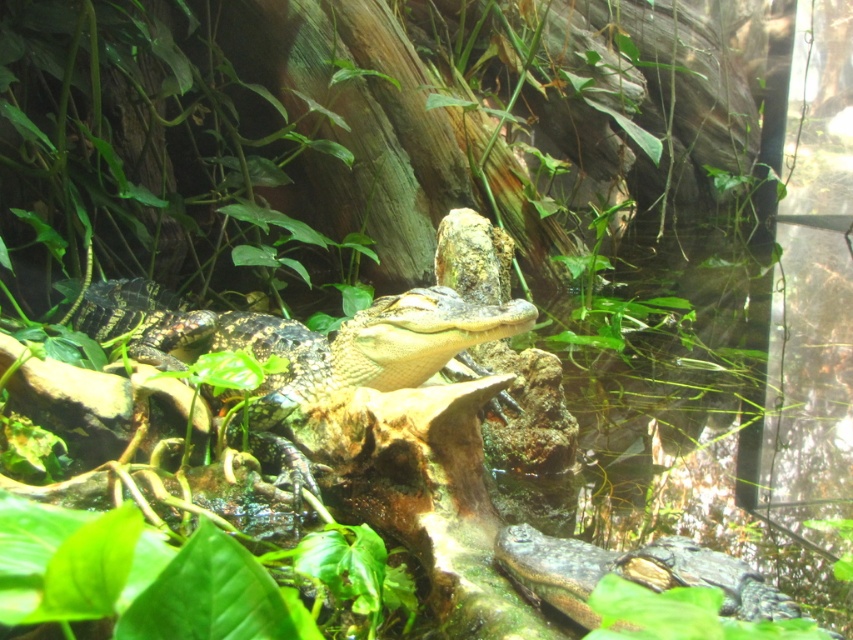
Question: Which of the following is the closest to the observer?

Choices:
 (A) shiny green crocodile at center
 (B) dark green scaly crocodile at lower right

Answer: (B)

Question: Which of the following is the farthest from the observer?

Choices:
 (A) (595, 566)
 (B) (393, 355)

Answer: (B)

Question: Can you confirm if shiny green crocodile at center is bigger than dark green scaly crocodile at lower right?

Choices:
 (A) yes
 (B) no

Answer: (A)

Question: Is shiny green crocodile at center to the left of dark green scaly crocodile at lower right from the viewer's perspective?

Choices:
 (A) no
 (B) yes

Answer: (B)

Question: Does shiny green crocodile at center have a smaller size compared to dark green scaly crocodile at lower right?

Choices:
 (A) yes
 (B) no

Answer: (B)